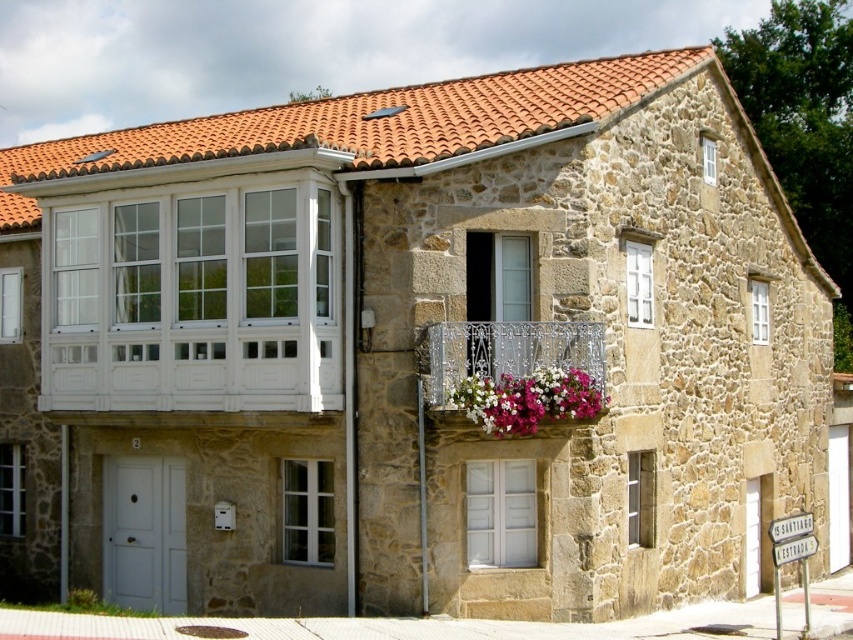
Between wrought iron balcony at center and pink fabric flowers at center, which one is positioned higher?

Positioned higher is wrought iron balcony at center.

Who is shorter, wrought iron balcony at center or pink fabric flowers at center?

With less height is pink fabric flowers at center.

Who is more forward, [467,330] or [546,403]?

Point [546,403] is more forward.

Locate an element on the screen. The width and height of the screenshot is (853, 640). wrought iron balcony at center is located at coordinates (506, 349).